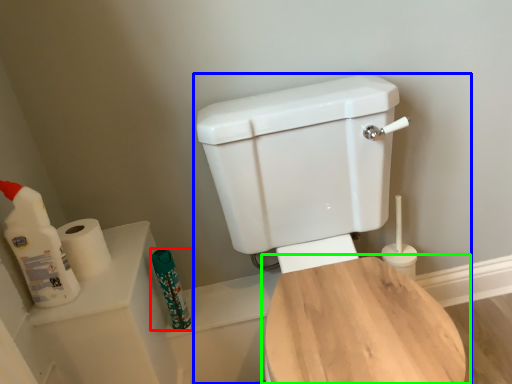
Question: Based on their relative distances, which object is farther from toiletry (highlighted by a red box)? Choose from toilet (highlighted by a blue box) and toilet (highlighted by a green box).

Choices:
 (A) toilet
 (B) toilet

Answer: (B)